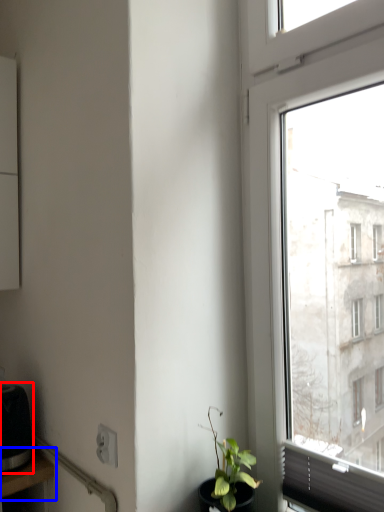
Question: Which object is closer to the camera taking this photo, appliance (highlighted by a red box) or table (highlighted by a blue box)?

Choices:
 (A) appliance
 (B) table

Answer: (B)